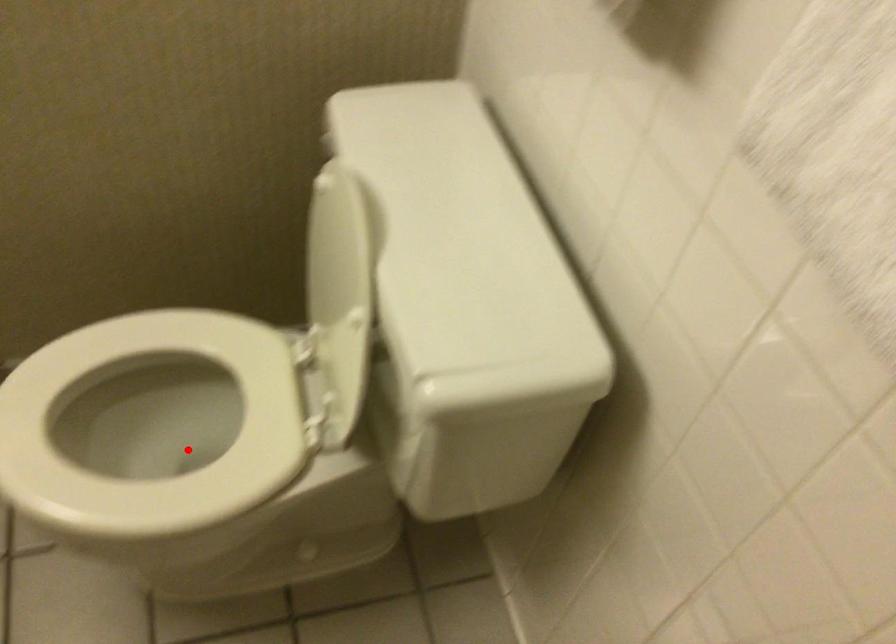
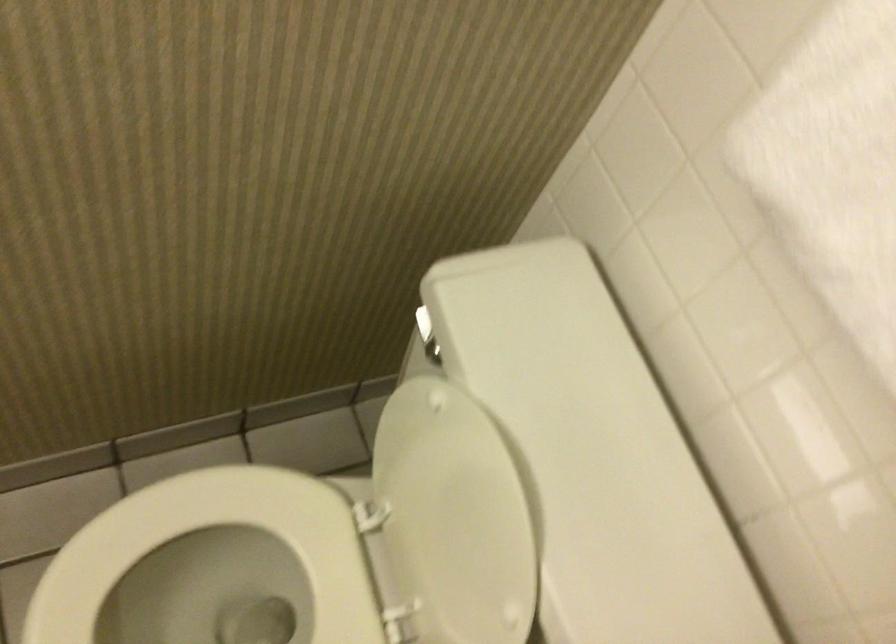
Locate, in the second image, the point that corresponds to the highlighted location in the first image.

(222, 590)